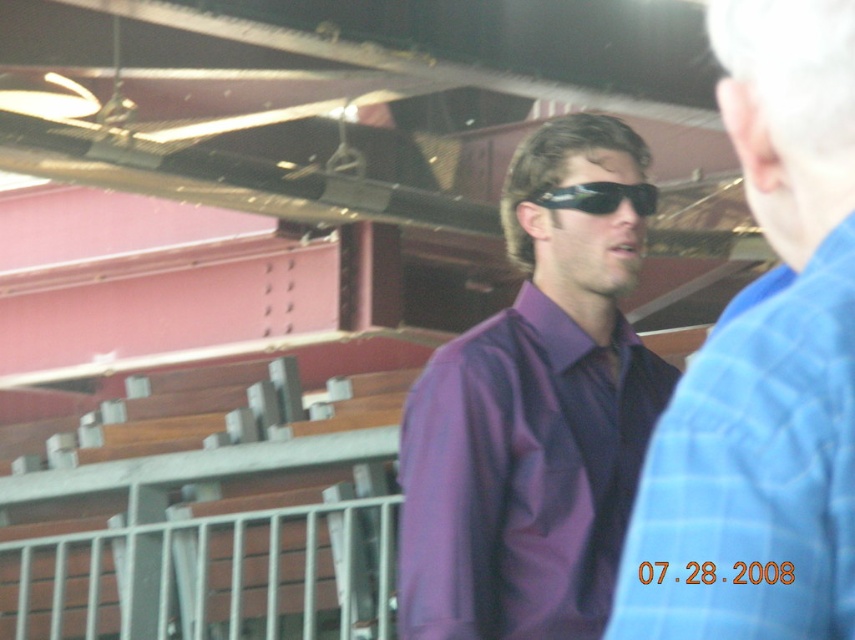
Question: Among these objects, which one is nearest to the camera?

Choices:
 (A) purple shiny shirt at center
 (B) purple smooth shirt at center

Answer: (A)

Question: Is purple shiny shirt at center smaller than sunglasses at center?

Choices:
 (A) yes
 (B) no

Answer: (B)

Question: Can you confirm if purple smooth shirt at center is positioned to the left of sunglasses at center?

Choices:
 (A) no
 (B) yes

Answer: (B)

Question: Among these points, which one is nearest to the camera?

Choices:
 (A) (820, 419)
 (B) (604, 212)
 (C) (543, 314)

Answer: (A)

Question: Which point is farther to the camera?

Choices:
 (A) (646, 211)
 (B) (540, 419)
 (C) (730, 628)

Answer: (A)

Question: Does purple shiny shirt at center have a lesser width compared to purple smooth shirt at center?

Choices:
 (A) no
 (B) yes

Answer: (B)